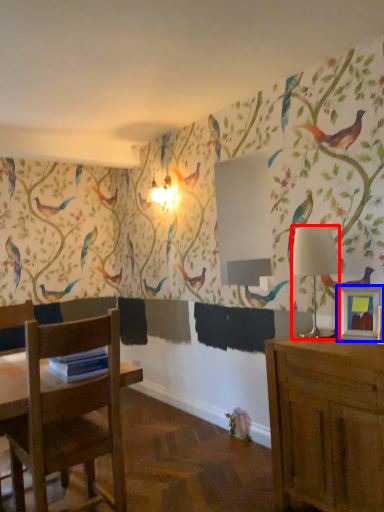
Question: Among these objects, which one is farthest to the camera, lamp (highlighted by a red box) or picture frame (highlighted by a blue box)?

Choices:
 (A) lamp
 (B) picture frame

Answer: (A)